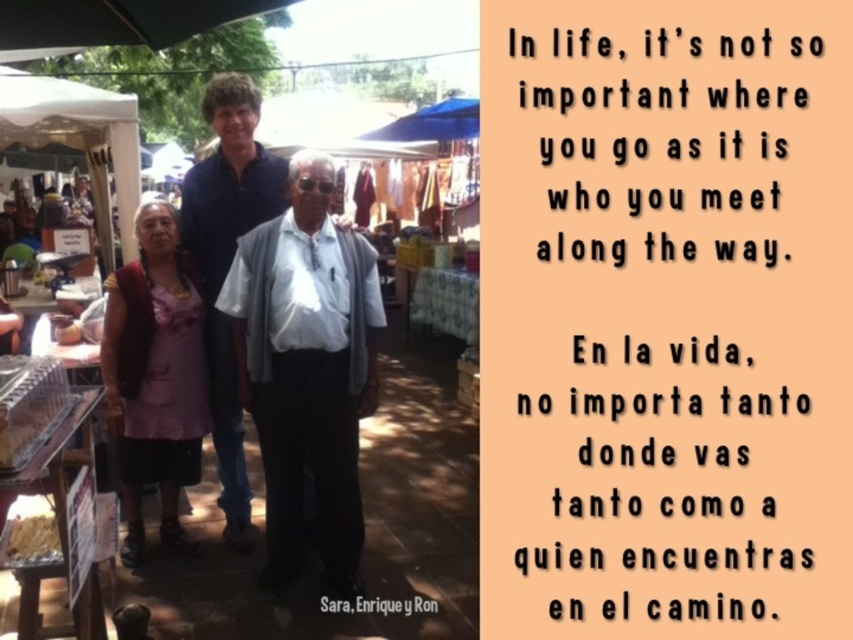
Based on the provided scene description, what is the spatial relationship between the white matte shirt at center and the blue cotton shirt at center?

The white matte shirt at center is positioned to the right of the blue cotton shirt at center.

You are a photographer trying to capture a candid shot of the white matte shirt at center and the pink fabric vest at left. Which of these two items should you focus on first if you want to ensure they are both in focus, given their height difference?

The white matte shirt at center is much taller than the pink fabric vest at left. To ensure both are in focus, focus on the white matte shirt at center first since it is taller and likely further away, allowing the depth of field to cover the closer pink fabric vest at left.